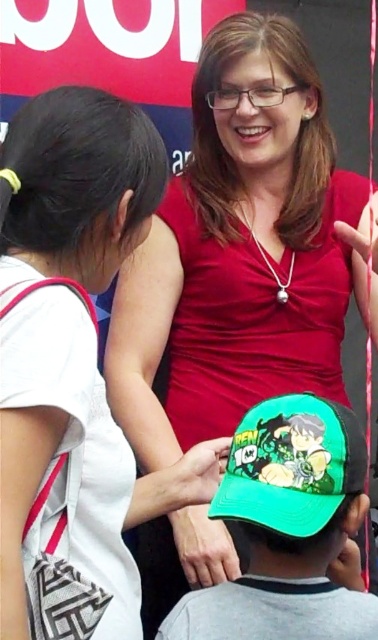
Question: Which of the following is the closest to the observer?

Choices:
 (A) (342, 298)
 (B) (212, 513)

Answer: (B)

Question: Which of the following is the farthest from the observer?

Choices:
 (A) matte green cap at center
 (B) green fabric cap at center

Answer: (A)

Question: Which point appears farthest from the camera in this image?

Choices:
 (A) (257, 156)
 (B) (288, 444)

Answer: (A)

Question: Can you confirm if matte green cap at center is positioned below green fabric cap at center?

Choices:
 (A) yes
 (B) no

Answer: (B)

Question: Does matte green cap at center appear over green fabric cap at lower center?

Choices:
 (A) no
 (B) yes

Answer: (B)

Question: Can you confirm if matte green cap at center is positioned to the left of green fabric cap at center?

Choices:
 (A) no
 (B) yes

Answer: (A)